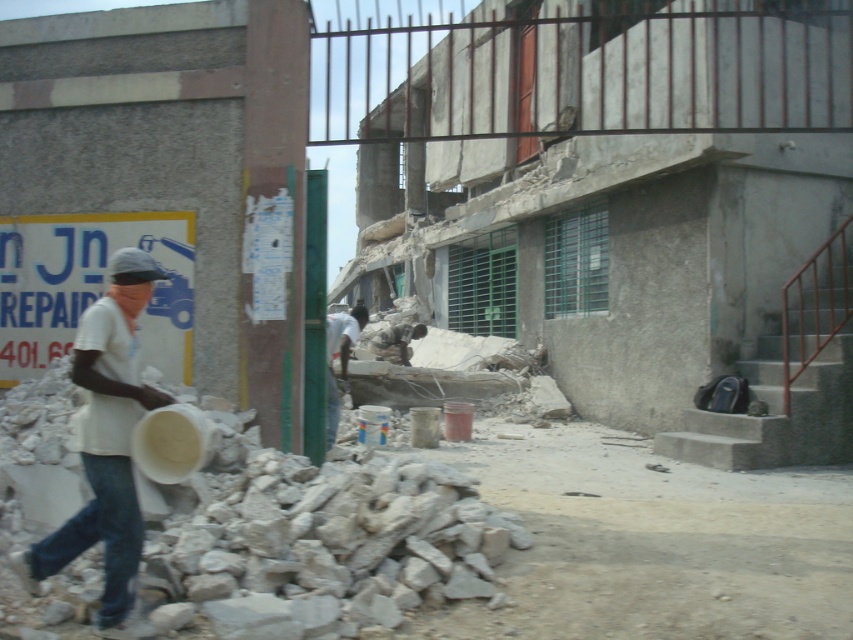
Question: Which point is closer to the camera?

Choices:
 (A) (360, 314)
 (B) (128, 634)

Answer: (B)

Question: Which point is closer to the camera?

Choices:
 (A) white fabric shirt at center
 (B) white matte bucket at left
 (C) jeans at left

Answer: (B)

Question: Does white matte bucket at left have a greater width compared to white fabric shirt at center?

Choices:
 (A) no
 (B) yes

Answer: (B)

Question: Does white matte bucket at left have a larger size compared to white fabric shirt at center?

Choices:
 (A) yes
 (B) no

Answer: (A)

Question: Which point appears farthest from the camera in this image?

Choices:
 (A) (38, 560)
 (B) (357, 330)
 (C) (103, 621)

Answer: (B)

Question: Is white matte bucket at left further to the viewer compared to jeans at left?

Choices:
 (A) yes
 (B) no

Answer: (B)